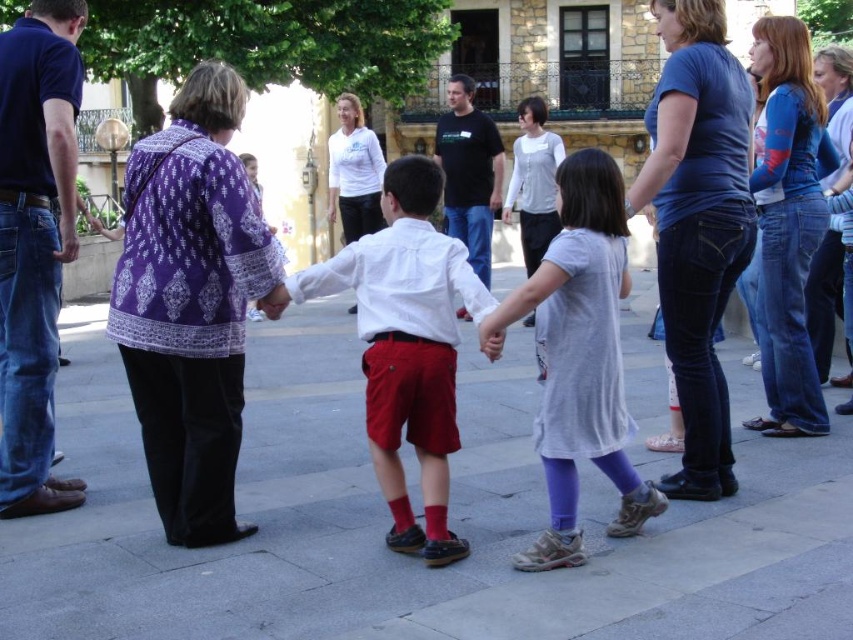
You are a photographer trying to capture a photo of the purple printed blouse at left and the red cotton sock at lower center. Which object should you focus on first if you want to ensure both are in sharp focus?

The purple printed blouse at left is taller than the red cotton sock at lower center, so focusing on the purple printed blouse at left first would ensure both are in sharp focus as it is farther away.

You are standing in the courtyard and want to find the matte white shirt at center. According to the coordinates given, where should you look?

You should look at point 0.508 on the x axis and 0.474 on the y axis to find the matte white shirt at center.

You are a photographer trying to capture a photo of both the purple printed blouse at left and the black cotton shirt at center. Since you want both subjects to be in focus, which one should you focus on first to ensure the other is also sharp?

You should focus on the black cotton shirt at center first because it is further away from the viewer than the purple printed blouse at left, so focusing on the further subject will keep both in focus.